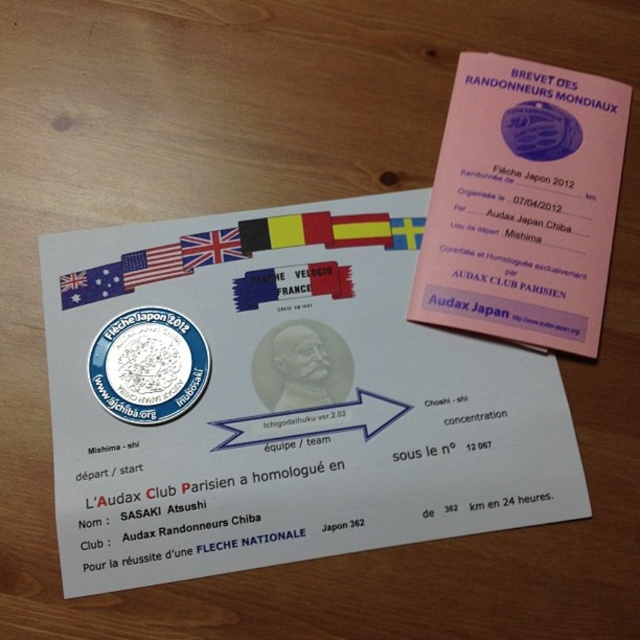
Is point (552, 323) more distant than point (92, 292)?

No, (552, 323) is in front of (92, 292).

Identify the location of pink paper at upper right. (524, 204).

Find the location of a particular element. pink paper at upper right is located at coordinates (524, 204).

Does point (252, 296) come closer to viewer compared to point (189, 272)?

Yes, point (252, 296) is closer to viewer.

Between white paper at upper center and british flag at center, which one has more height?

white paper at upper center is taller.

What do you see at coordinates (285, 403) in the screenshot? I see `white paper at upper center` at bounding box center [285, 403].

I want to click on white paper at upper center, so click(285, 403).

Looking at this image, which of these two, pink paper at upper right or silver metallic coin at center, stands shorter?

With less height is silver metallic coin at center.

Is pink paper at upper right above silver metallic coin at center?

Correct, pink paper at upper right is located above silver metallic coin at center.

This screenshot has height=640, width=640. What do you see at coordinates (524, 204) in the screenshot?
I see `pink paper at upper right` at bounding box center [524, 204].

I want to click on pink paper at upper right, so click(524, 204).